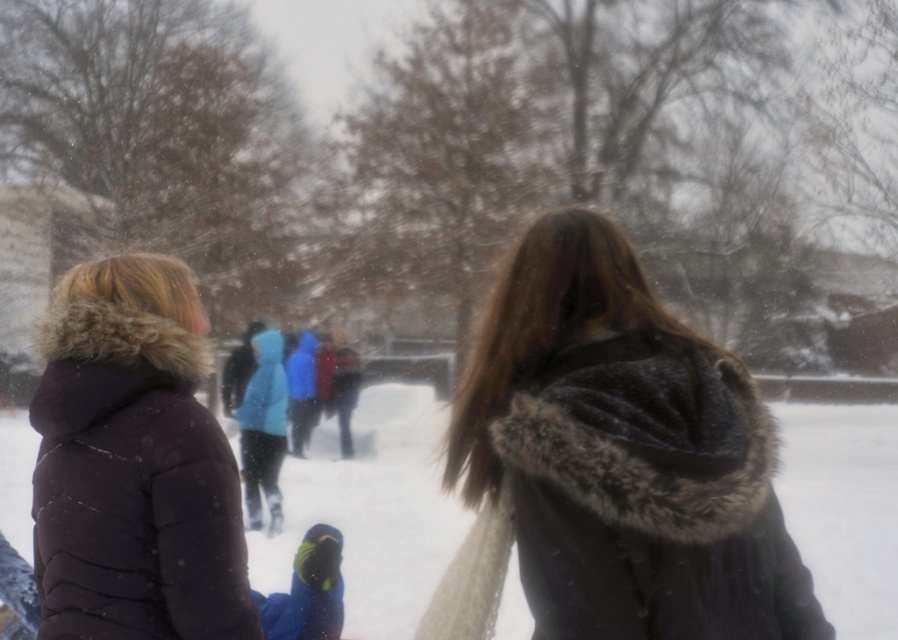
You are standing at the point with coordinates point (x=489, y=486) and want to walk to the point with coordinates point (x=885, y=596). Based on the scene description, will you have a clear path to walk towards that point without any obstructions?

Yes, you will have a clear path to walk towards point (x=885, y=596) from point (x=489, y=486) because point (x=489, y=486) is in front of point (x=885, y=596), meaning there are no obstructions blocking the way between them.